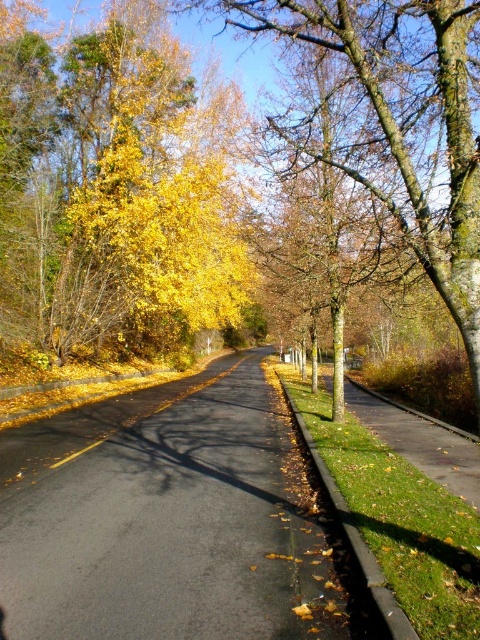
You are standing at the point marked by the coordinates point (116, 189) in the image. Looking towards the road stretching ahead, which direction would you face to see the yellow leafy tree at left?

The point (116, 189) indicates the yellow leafy tree at left, so you are already facing it.